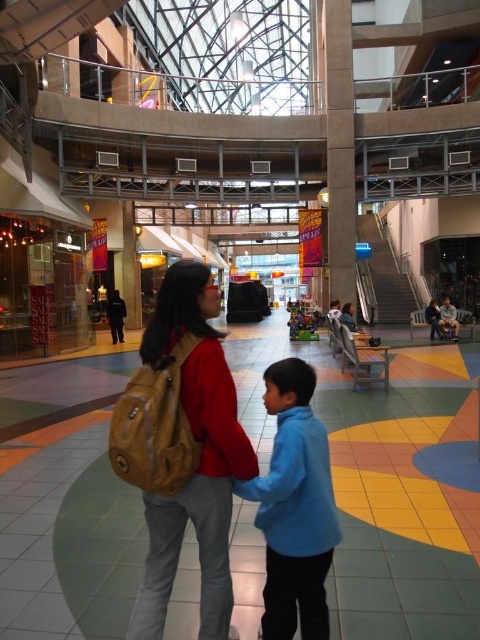
Does leather backpack at center have a smaller size compared to blue fleece jacket at center?

Incorrect, leather backpack at center is not smaller in size than blue fleece jacket at center.

Does point (227, 588) come in front of point (274, 406)?

No, it is not.

In order to click on leather backpack at center in this screenshot , I will do `click(202, 369)`.